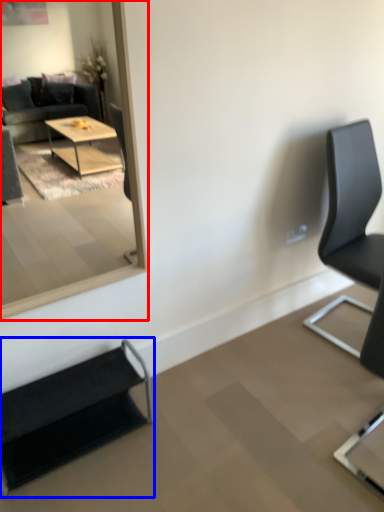
Question: Which object is closer to the camera taking this photo, mirror (highlighted by a red box) or chair (highlighted by a blue box)?

Choices:
 (A) mirror
 (B) chair

Answer: (A)